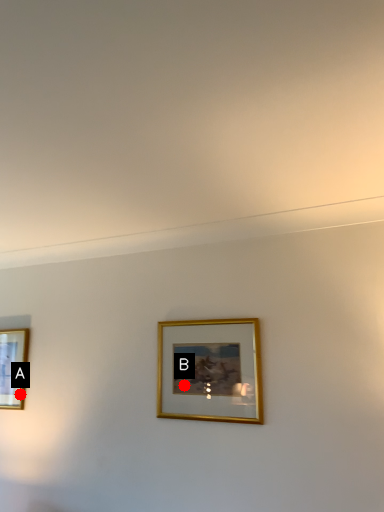
Question: Two points are circled on the image, labeled by A and B beside each circle. Which of the following is the farthest from the observer?

Choices:
 (A) A is further
 (B) B is further

Answer: (A)